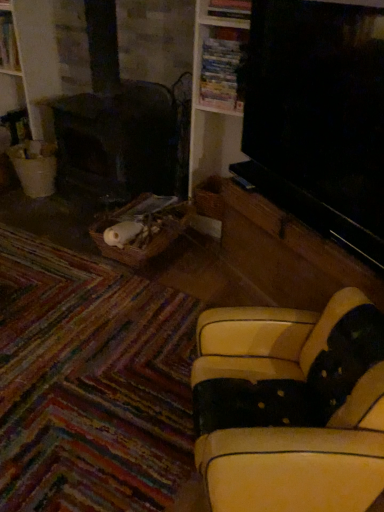
Question: Considering the positions of leather-like yellow couch at lower right and wooden bookshelf at upper center in the image, is leather-like yellow couch at lower right wider or thinner than wooden bookshelf at upper center?

Choices:
 (A) wide
 (B) thin

Answer: (A)

Question: In the image, is leather-like yellow couch at lower right on the left side or the right side of wooden bookshelf at upper center?

Choices:
 (A) left
 (B) right

Answer: (B)

Question: Which is nearer to the wooden bookshelf at upper center?

Choices:
 (A) leather-like yellow couch at lower right
 (B) white painted wood bookshelf at upper left

Answer: (B)

Question: Which is farther from the leather-like yellow couch at lower right?

Choices:
 (A) wooden bookshelf at upper center
 (B) white painted wood bookshelf at upper left

Answer: (B)